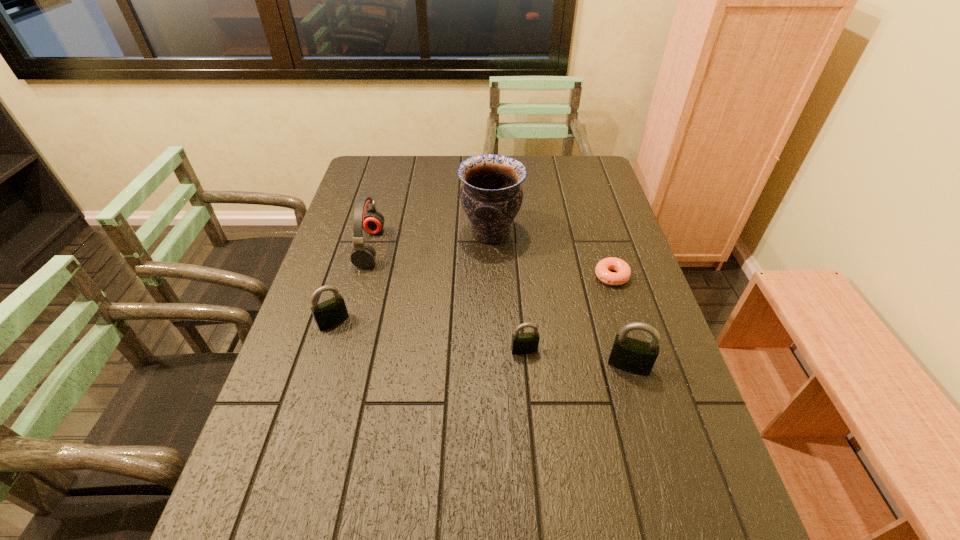
To make them evenly spaced by inserting another padlock among them, please locate a free space for this new padlock. Please provide its 2D coordinates. Your answer should be formatted as a tuple, i.e. [(x, y)], where the tuple contains the x and y coordinates of a point satisfying the conditions above.

[(426, 335)]